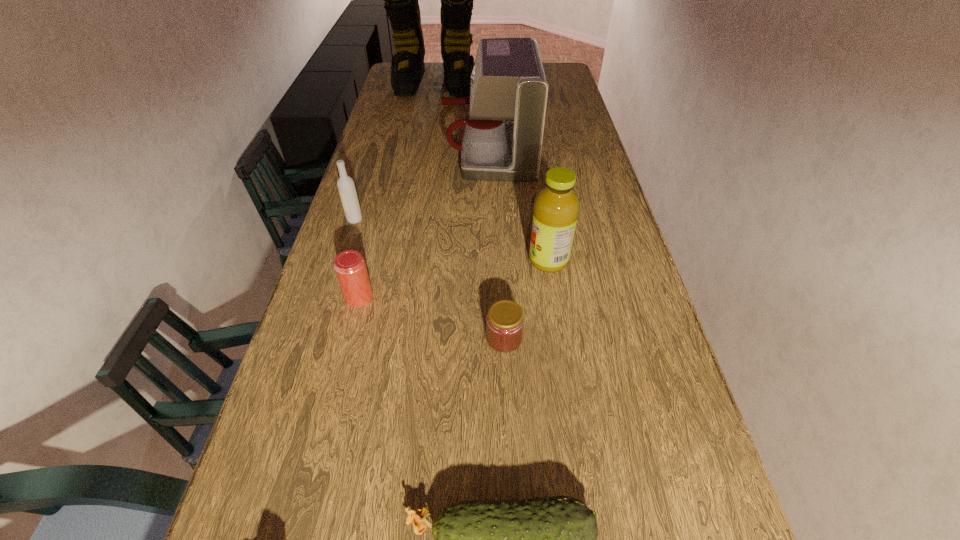
At what (x,y) coordinates should I click in order to perform the action: click on the second nearest object. Please return your answer as a coordinate pair (x, y). Looking at the image, I should click on [x=505, y=321].

Where is `free space located 0.240m on the front of the farthest object`? free space located 0.240m on the front of the farthest object is located at coordinates (426, 127).

The image size is (960, 540). I want to click on free space located 0.150m on the front of the coffee maker near the spout, so click(402, 154).

Where is `vacant region located on the front of the coffee maker near the spout`? vacant region located on the front of the coffee maker near the spout is located at coordinates (402, 154).

The width and height of the screenshot is (960, 540). Identify the location of free point located on the front of the coffee maker near the spout. (x=408, y=154).

Where is `blank space located 0.090m on the front label of the fourth nearest object`? The image size is (960, 540). blank space located 0.090m on the front label of the fourth nearest object is located at coordinates (495, 260).

This screenshot has height=540, width=960. Find the location of `free space located on the front label of the fourth nearest object`. free space located on the front label of the fourth nearest object is located at coordinates (422, 260).

Find the location of a particular element. The width and height of the screenshot is (960, 540). free spot located 0.350m on the front label of the fourth nearest object is located at coordinates (400, 260).

Locate an element on the screen. The image size is (960, 540). vacant area located on the front of the vodka is located at coordinates (341, 265).

Find the location of `vacant space positioned on the back of the third nearest object`. vacant space positioned on the back of the third nearest object is located at coordinates pos(367,265).